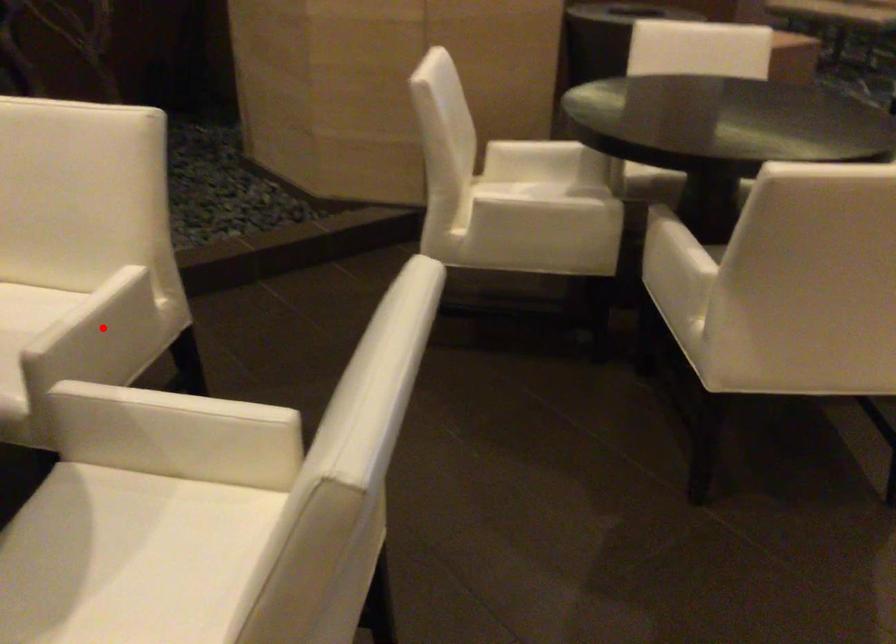
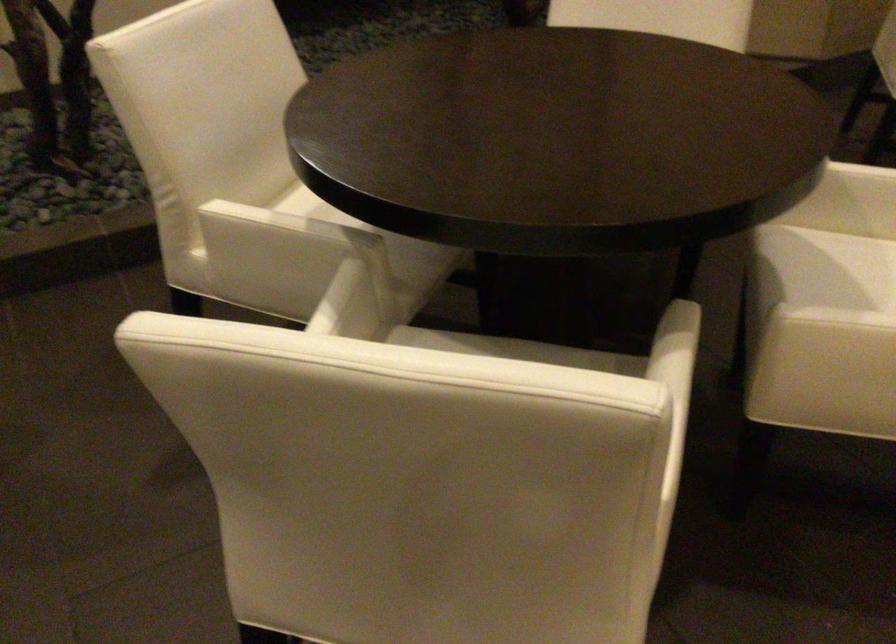
Question: I am providing you with two images of the same scene from different viewpoints. A red point is marked on the first image. At the location where the point appears in image 1, is it still visible in image 2?

Choices:
 (A) Yes
 (B) No

Answer: (B)